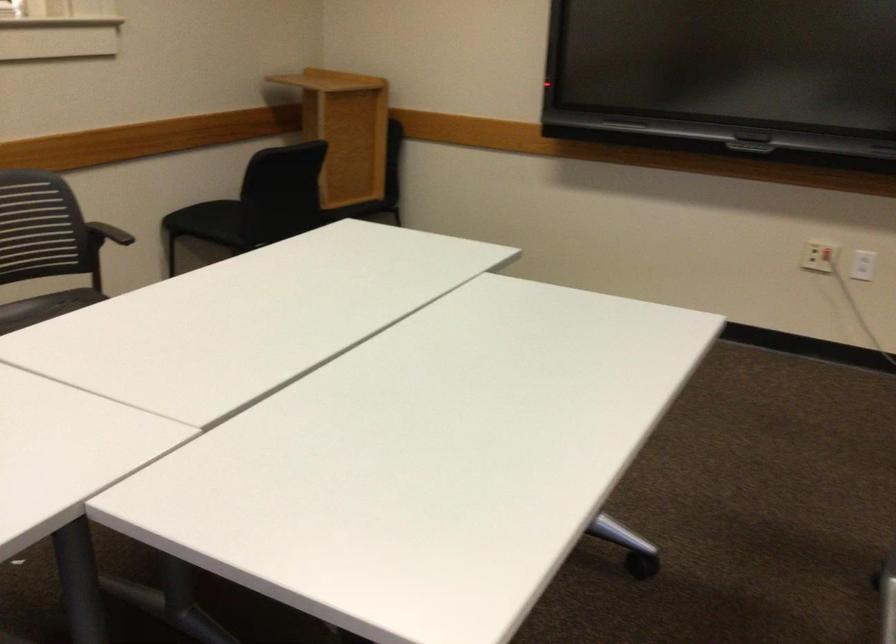
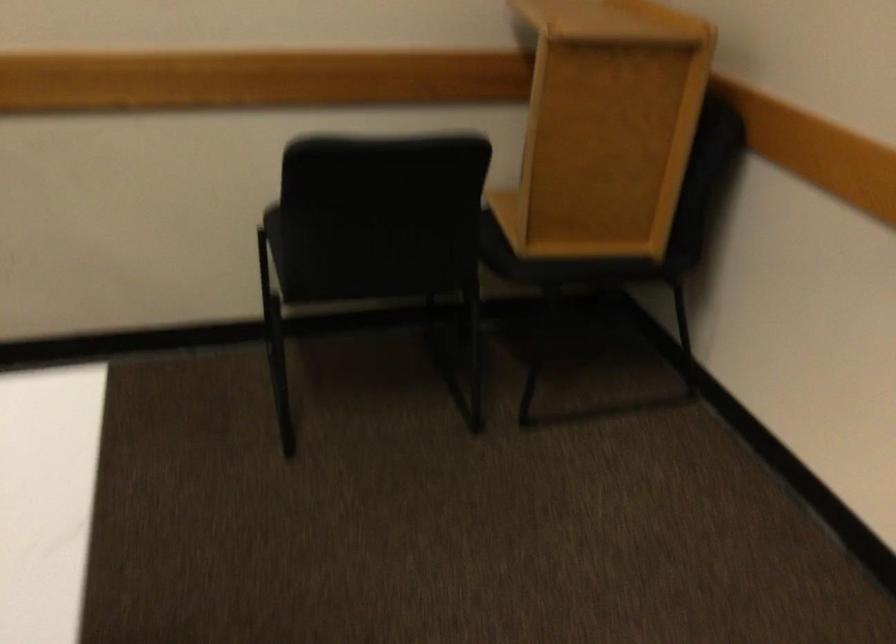
The point at (366, 201) is marked in the first image. Where is the corresponding point in the second image?

(586, 263)